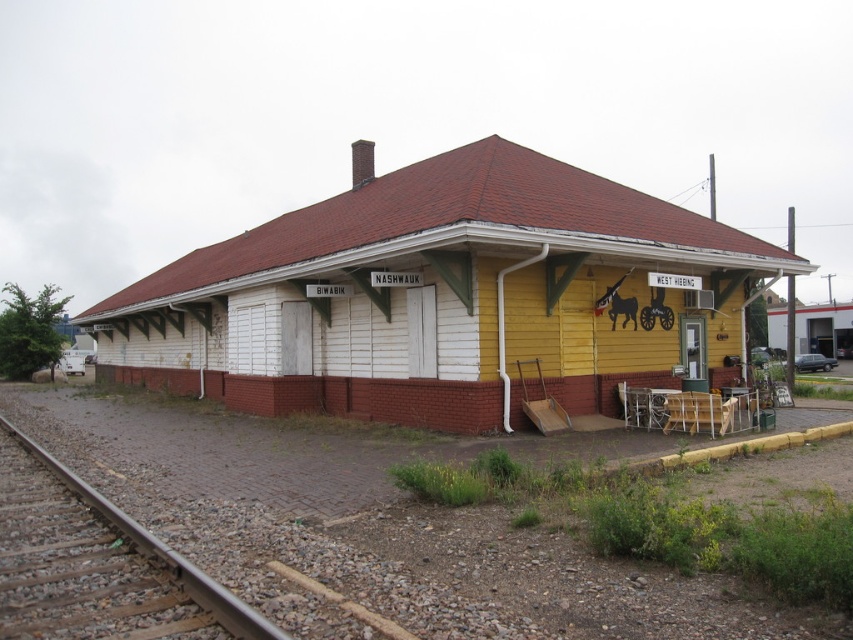
You are a train engineer approaching the yellow wood railway station at center. You see the brown wooden train track at lower left. Which direction should you steer your train to align with the tracks leading into the station?

The yellow wood railway station at center is positioned over the brown wooden train track at lower left, so you should steer your train towards the lower left direction to align with the tracks leading into the station.

You are a train conductor planning to park your train at the yellow wood railway station at center. The train is 10 meters long. Can you fit the train into the brown wooden train track at lower left?

The yellow wood railway station at center might be wider than the brown wooden train track at lower left, but the description does not provide exact measurements of the track length. Therefore, it is uncertain if the 10 meter train will fit. Check the track length before deciding.